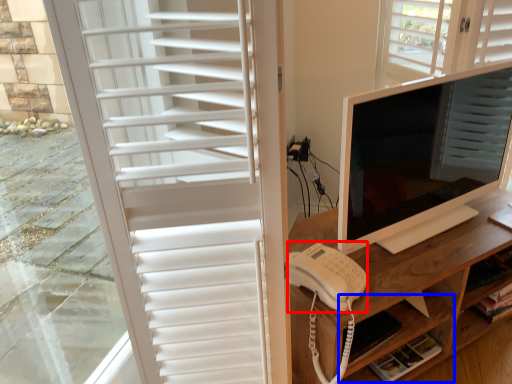
Question: Which of the following is the closest to the observer, open (highlighted by a red box) or shelf (highlighted by a blue box)?

Choices:
 (A) open
 (B) shelf

Answer: (A)